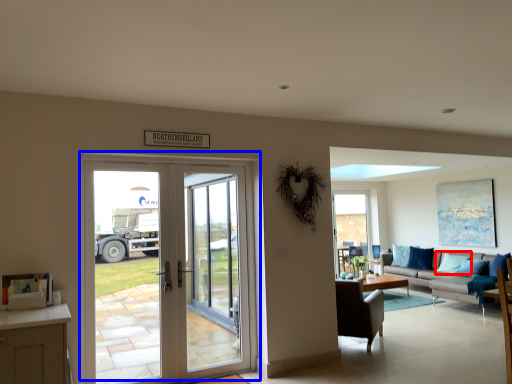
Question: Which point is closer to the camera, pillow (highlighted by a red box) or door (highlighted by a blue box)?

Choices:
 (A) pillow
 (B) door

Answer: (B)